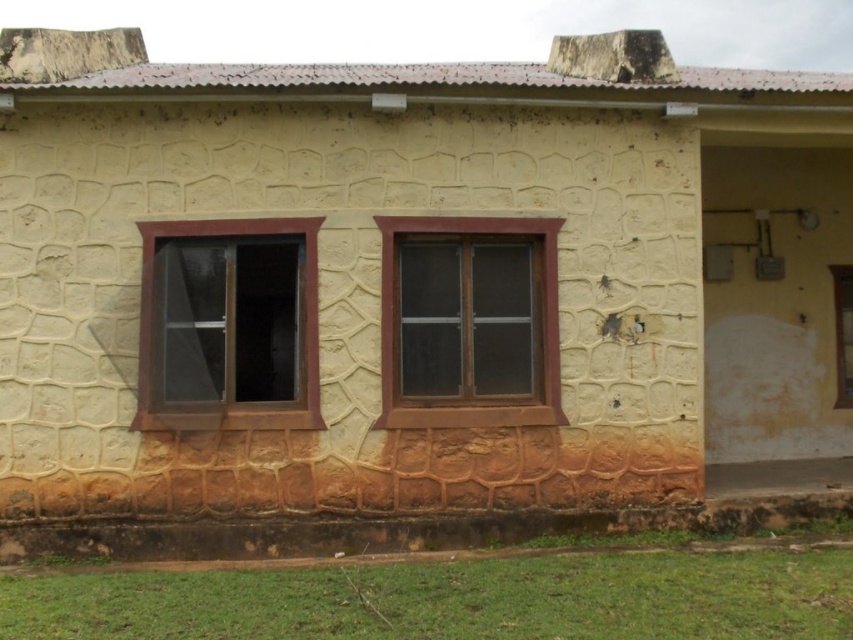
You are standing in front of the building and want to clean the windows. Which window should you clean first, the brown wooden window at left or the brown wooden window at center, if you want to start from the lower one?

The brown wooden window at left is below the brown wooden window at center, so you should clean the brown wooden window at left first if you want to start from the lower one.

You are standing in front of the building and want to clean the windows. Which window should you reach first, the brown wooden window at center or the clear glass window at center right?

The brown wooden window at center is closer to the viewer than the clear glass window at center right, so you should reach the brown wooden window at center first.

You are standing at the entrance of the building and see two points marked on the wall. The first point is labeled as point (178, 236) and the second as point (849, 378). Which point is closer to you?

Point (178, 236) is in front of point (849, 378), so it is closer to you.